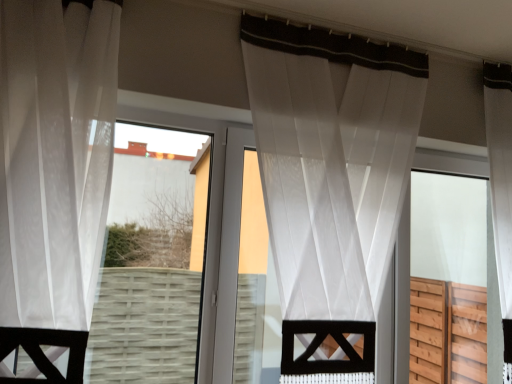
Question: Is transparent wood screen door at right thinner than white sheer curtain at left, the first curtain when ordered from left to right?

Choices:
 (A) no
 (B) yes

Answer: (B)

Question: Is transparent wood screen door at right not within white sheer curtain at left, the first curtain when ordered from left to right?

Choices:
 (A) no
 (B) yes

Answer: (B)

Question: Is transparent wood screen door at right far from white sheer curtain at left, marked as the 2th curtain in a right-to-left arrangement?

Choices:
 (A) yes
 (B) no

Answer: (A)

Question: From a real-world perspective, is transparent wood screen door at right located beneath white sheer curtain at left, the first curtain when ordered from left to right?

Choices:
 (A) yes
 (B) no

Answer: (A)

Question: From the image's perspective, is transparent wood screen door at right on white sheer curtain at left, the first curtain when ordered from left to right?

Choices:
 (A) yes
 (B) no

Answer: (B)

Question: Is white sheer curtain at left, placed as the 2th curtain when sorted from back to front, at the back of transparent wood screen door at right?

Choices:
 (A) yes
 (B) no

Answer: (B)

Question: Could transparent fabric at center be considered to be inside transparent wood screen door at right?

Choices:
 (A) yes
 (B) no

Answer: (B)

Question: Is transparent wood screen door at right outside transparent fabric at center?

Choices:
 (A) yes
 (B) no

Answer: (A)

Question: Does transparent wood screen door at right have a lesser width compared to transparent fabric at center?

Choices:
 (A) no
 (B) yes

Answer: (A)

Question: Is transparent wood screen door at right facing towards transparent fabric at center?

Choices:
 (A) yes
 (B) no

Answer: (B)

Question: Considering the relative positions of transparent wood screen door at right and transparent fabric at center in the image provided, is transparent wood screen door at right in front of transparent fabric at center?

Choices:
 (A) yes
 (B) no

Answer: (B)

Question: Does transparent wood screen door at right appear on the right side of transparent fabric at center?

Choices:
 (A) no
 (B) yes

Answer: (B)

Question: Is white sheer curtain at left, the 1th curtain from the front, taller than transparent fabric at center?

Choices:
 (A) yes
 (B) no

Answer: (A)